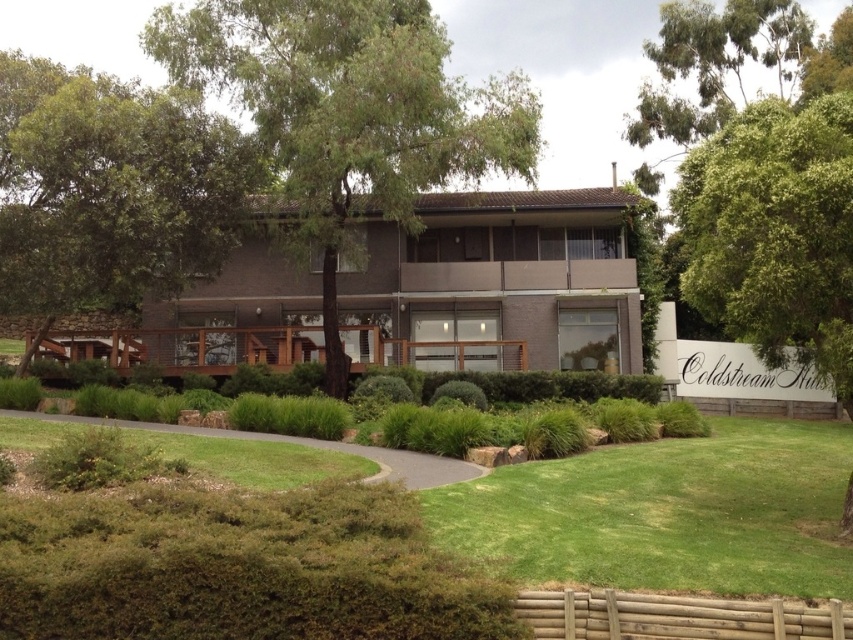
Question: Can you confirm if dark brown brick building at center is positioned above green leafy tree at center?

Choices:
 (A) yes
 (B) no

Answer: (B)

Question: Which of the following is the closest to the observer?

Choices:
 (A) dark brown brick building at center
 (B) green grass at lower center
 (C) green leafy tree at right
 (D) green leafy tree at upper left

Answer: (B)

Question: Is dark brown brick building at center closer to the viewer compared to green leafy tree at upper left?

Choices:
 (A) yes
 (B) no

Answer: (B)

Question: Based on their relative distances, which object is farther from the green leafy tree at upper left?

Choices:
 (A) green leafy tree at right
 (B) green leafy tree at center

Answer: (A)

Question: Estimate the real-world distances between objects in this image. Which object is farther from the green leafy tree at right?

Choices:
 (A) green leafy tree at center
 (B) dark brown brick building at center
 (C) green grass at lower left
 (D) green leafy tree at upper left

Answer: (D)

Question: Is green grass at lower center positioned at the back of green leafy tree at upper left?

Choices:
 (A) yes
 (B) no

Answer: (B)